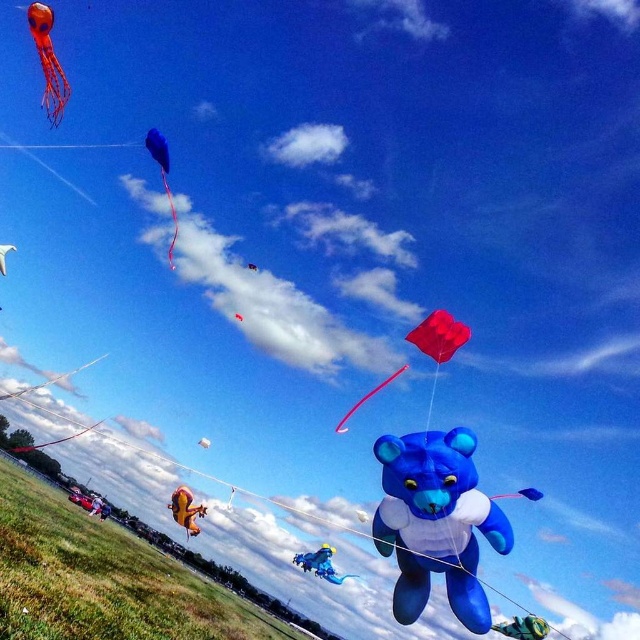
Based on the photo, who is lower down, shiny red kite at center or red matte kite at center?

shiny red kite at center is lower down.

This screenshot has height=640, width=640. In order to click on shiny red kite at center in this screenshot , I will do `click(438, 336)`.

Is point (451, 336) positioned behind point (248, 264)?

No, (451, 336) is in front of (248, 264).

I want to click on shiny red kite at center, so click(438, 336).

Is translucent orange jellyfish at upper left below white matte kite at center?

No, translucent orange jellyfish at upper left is not below white matte kite at center.

Does translucent orange jellyfish at upper left lie behind white matte kite at center?

No, translucent orange jellyfish at upper left is closer to the viewer.

In order to click on translucent orange jellyfish at upper left in this screenshot , I will do `click(48, 61)`.

I want to click on translucent orange jellyfish at upper left, so click(x=48, y=61).

Describe the element at coordinates (99, 577) in the screenshot. This screenshot has height=640, width=640. I see `yellow fabric kite at lower center` at that location.

Between yellow fabric kite at lower center and white matte kite at center, which one is positioned higher?

white matte kite at center is above.

Is point (164, 616) behind point (205, 440)?

No, it is not.

You are a GUI agent. You are given a task and a screenshot of the screen. Output one action in this format:
    pyautogui.click(x=<x>, y=<y>)
    Task: Click on the yellow fabric kite at lower center
    
    Given the screenshot: What is the action you would take?
    pyautogui.click(x=99, y=577)